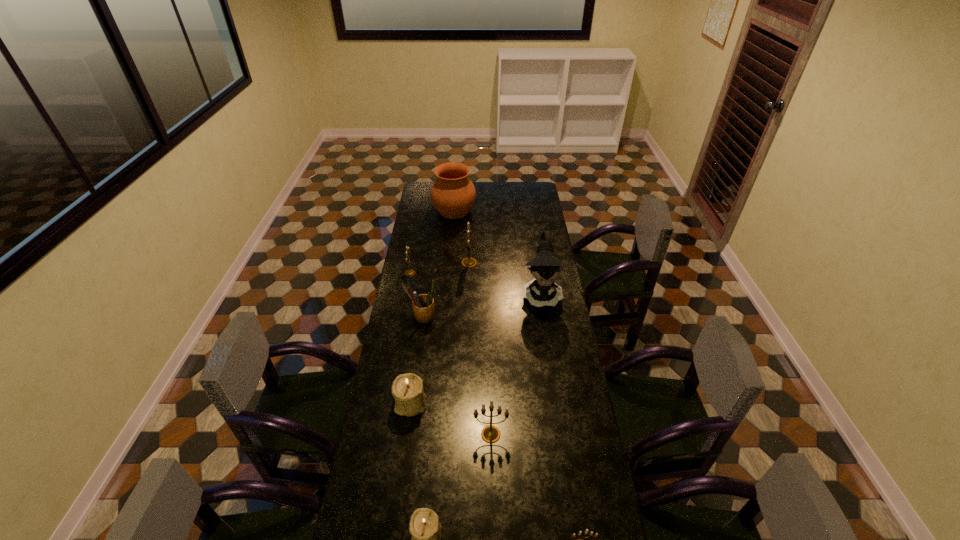
Locate an element on the screen. The height and width of the screenshot is (540, 960). object positioned at the far left corner is located at coordinates (453, 194).

This screenshot has width=960, height=540. In the image, there is a desktop. Find the location of `vacant space at the far edge`. vacant space at the far edge is located at coordinates (504, 193).

Identify the location of free region at the left edge. The height and width of the screenshot is (540, 960). (406, 293).

You are a GUI agent. You are given a task and a screenshot of the screen. Output one action in this format:
    pyautogui.click(x=<x>, y=<y>)
    Task: Click on the blank space at the right edge of the desktop
    The height and width of the screenshot is (540, 960).
    Given the screenshot: What is the action you would take?
    pyautogui.click(x=530, y=260)

Image resolution: width=960 pixels, height=540 pixels. In order to click on free space at the far left corner in this screenshot , I will do `click(426, 182)`.

This screenshot has width=960, height=540. What are the coordinates of `empty location between the farthest object and the doll` in the screenshot? It's located at (497, 252).

The height and width of the screenshot is (540, 960). Find the location of `vacant space in between the doll and the biggest gold candelabrum`. vacant space in between the doll and the biggest gold candelabrum is located at coordinates (505, 279).

At what (x,y) coordinates should I click in order to perform the action: click on free space between the biggest gold candelabrum and the second smallest gold candelabrum. Please return your answer as a coordinate pair (x, y). Looking at the image, I should click on (440, 268).

This screenshot has width=960, height=540. What are the coordinates of `object that ranks as the closest to the fourth nearest candelabrum` in the screenshot? It's located at (490, 434).

Identify the location of object that ranks as the eighth closest to the pottery. (586, 532).